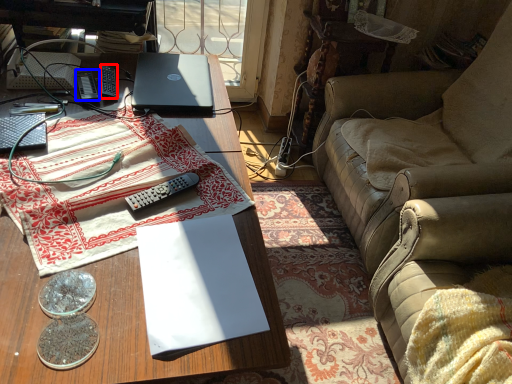
Question: Which of the following is the farthest to the observer, remote control (highlighted by a red box) or remote control (highlighted by a blue box)?

Choices:
 (A) remote control
 (B) remote control

Answer: (A)